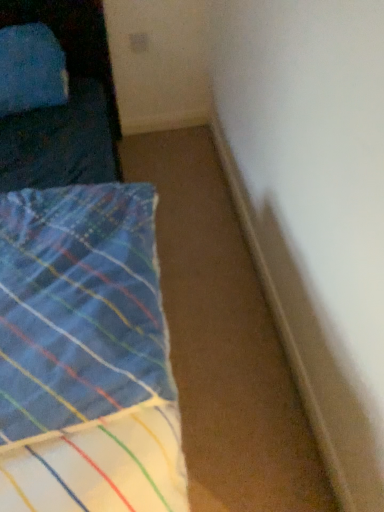
Question: Visually, is blue plaid fabric at left positioned to the left or to the right of blue fabric pillow at upper left?

Choices:
 (A) left
 (B) right

Answer: (B)

Question: Considering the positions of point (148, 313) and point (79, 161), is point (148, 313) closer or farther from the camera than point (79, 161)?

Choices:
 (A) farther
 (B) closer

Answer: (B)

Question: Choose the correct answer: Is blue plaid fabric at left inside blue fabric pillow at upper left or outside it?

Choices:
 (A) outside
 (B) inside

Answer: (A)

Question: Is blue fabric pillow at upper left inside the boundaries of blue plaid fabric at left, or outside?

Choices:
 (A) outside
 (B) inside

Answer: (A)

Question: Is blue fabric pillow at upper left in front of or behind blue plaid fabric at left in the image?

Choices:
 (A) front
 (B) behind

Answer: (B)

Question: Is blue fabric pillow at upper left taller or shorter than blue plaid fabric at left?

Choices:
 (A) short
 (B) tall

Answer: (B)

Question: From the image's perspective, is blue fabric pillow at upper left positioned above or below blue plaid fabric at left?

Choices:
 (A) above
 (B) below

Answer: (A)